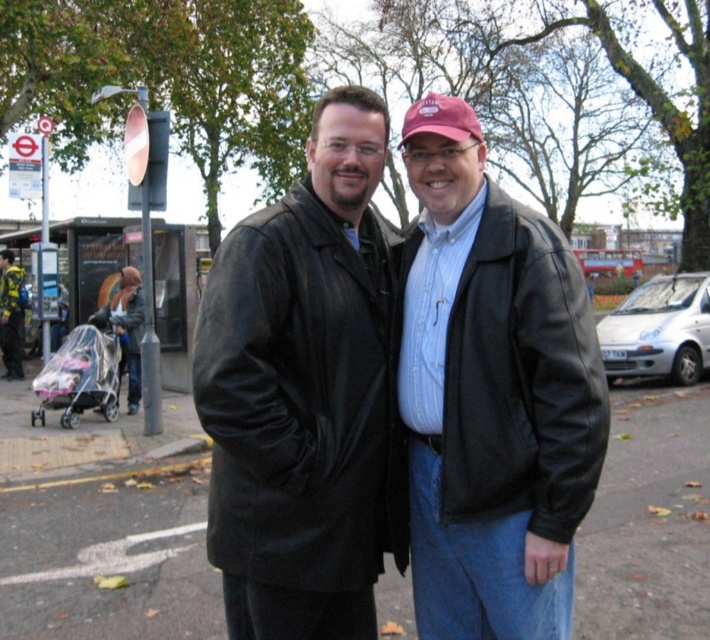
Is point (133, 392) farther from viewer compared to point (6, 308)?

No, it is not.

Locate an element on the screen. matte plastic baby carriage at left is located at coordinates (125, 328).

Between point (102, 321) and point (0, 257), which one is positioned behind?

Point (0, 257)

This screenshot has width=710, height=640. In order to click on matte plastic baby carriage at left in this screenshot , I will do `click(125, 328)`.

Consider the image. Is black leather jackets at center taller than yellow-green fabric jacket at left?

No, black leather jackets at center is not taller than yellow-green fabric jacket at left.

Consider the image. Measure the distance between point (447, 413) and camera.

2.14 meters

Who is more forward, (471, 600) or (10, 273)?

Point (471, 600) is more forward.

You are a GUI agent. You are given a task and a screenshot of the screen. Output one action in this format:
    pyautogui.click(x=<x>, y=<y>)
    Task: Click on the black leather jackets at center
    This screenshot has width=710, height=640.
    Given the screenshot: What is the action you would take?
    pyautogui.click(x=420, y=400)

Which is more to the left, black leather jackets at center or matte plastic baby carriage at left?

matte plastic baby carriage at left is more to the left.

Can you confirm if black leather jackets at center is wider than matte plastic baby carriage at left?

Indeed, black leather jackets at center has a greater width compared to matte plastic baby carriage at left.

What do you see at coordinates (420, 400) in the screenshot? The image size is (710, 640). I see `black leather jackets at center` at bounding box center [420, 400].

Locate an element on the screen. The height and width of the screenshot is (640, 710). black leather jackets at center is located at coordinates (420, 400).